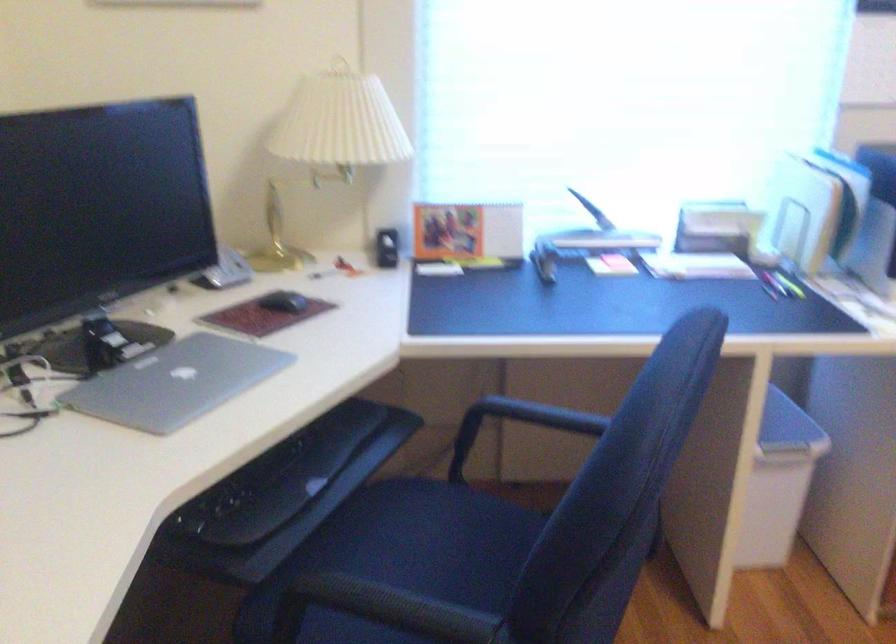
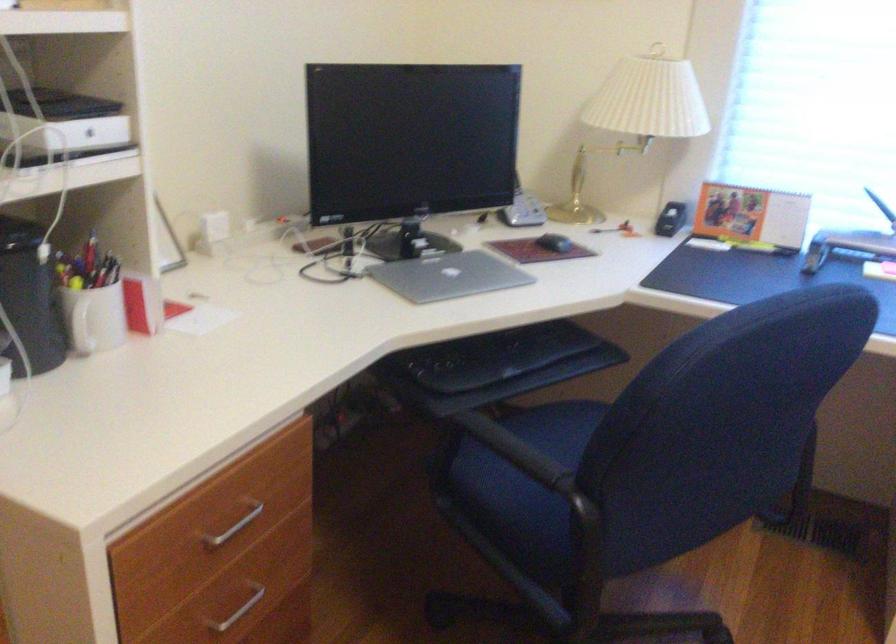
Where in the second image is the point corresponding to the point at 288,489 from the first image?

(494, 366)